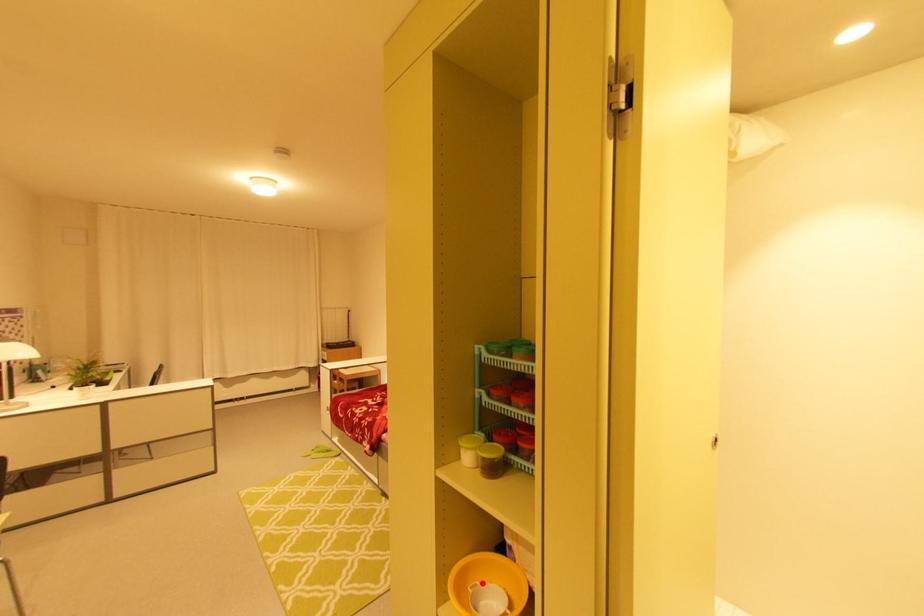
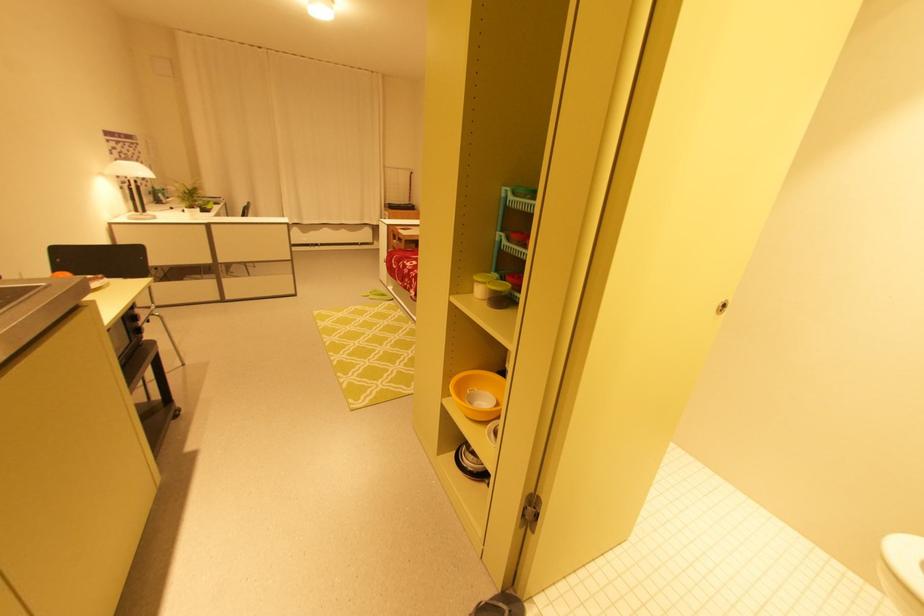
The point at the highlighted location is marked in the first image. Where is the corresponding point in the second image?

(480, 390)